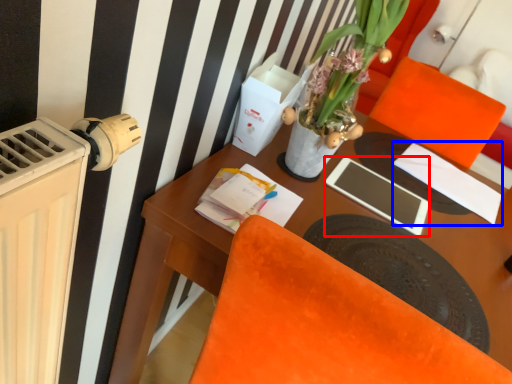
Question: Which of the following is the closest to the observer, tablet computer (highlighted by a red box) or notepad (highlighted by a blue box)?

Choices:
 (A) tablet computer
 (B) notepad

Answer: (A)